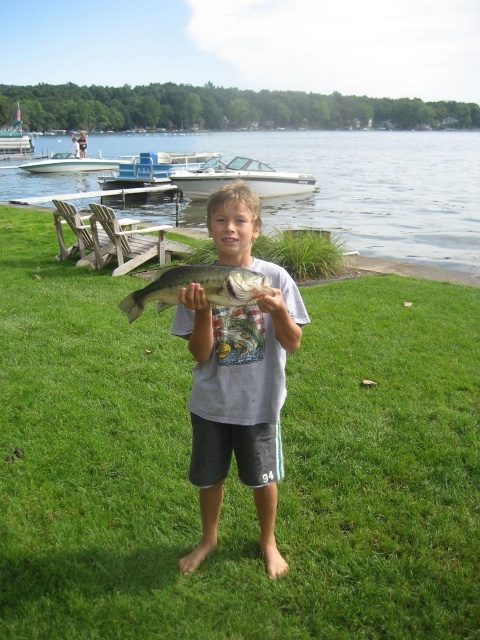
You are a photographer trying to capture the green shiny fish at center and the white glossy boat at upper left in the same frame. Which object should you focus on first if you want to ensure both are in focus without adjusting the camera settings?

Since the green shiny fish at center is smaller in size compared to the white glossy boat at upper left, you should focus on the larger object first. This will help ensure both are in focus as the depth of field is more forgiving for larger subjects.